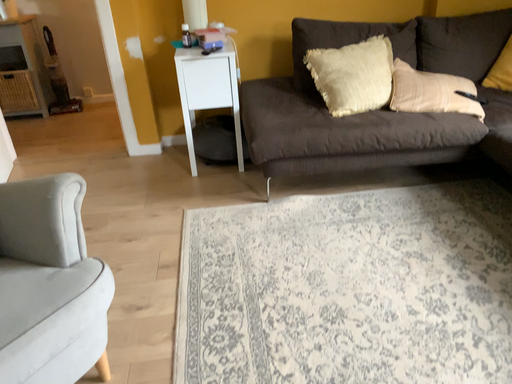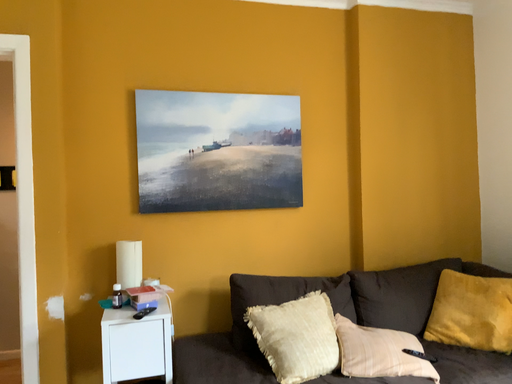
Question: How did the camera likely rotate when shooting the video?

Choices:
 (A) rotated downward
 (B) rotated upward

Answer: (B)